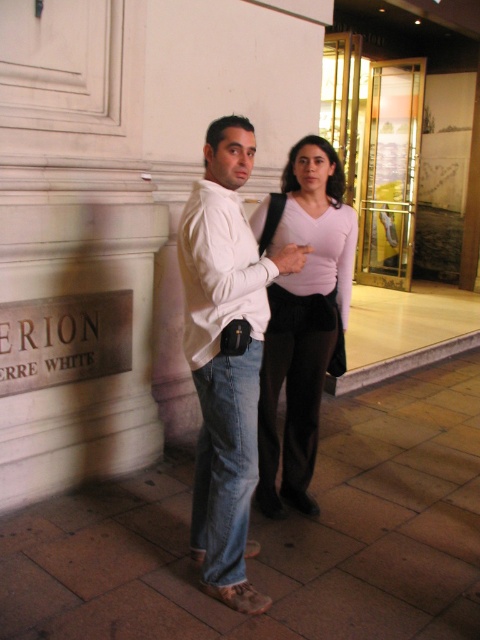
Question: Which point is closer to the camera?

Choices:
 (A) (248, 436)
 (B) (282, 326)
 (C) (256, 598)

Answer: (A)

Question: Which of the following is the closest to the observer?

Choices:
 (A) (276, 314)
 (B) (239, 307)

Answer: (B)

Question: Does pink matte shirt at center have a lesser width compared to denim jeans at lower center?

Choices:
 (A) yes
 (B) no

Answer: (B)

Question: Does matte white shirt at center have a lesser width compared to pink matte shirt at center?

Choices:
 (A) no
 (B) yes

Answer: (A)

Question: Which object appears closest to the camera in this image?

Choices:
 (A) denim jeans at lower center
 (B) matte white shirt at center
 (C) pink matte shirt at center

Answer: (B)

Question: Considering the relative positions of pink matte shirt at center and denim jeans at lower center in the image provided, where is pink matte shirt at center located with respect to denim jeans at lower center?

Choices:
 (A) left
 (B) right

Answer: (B)